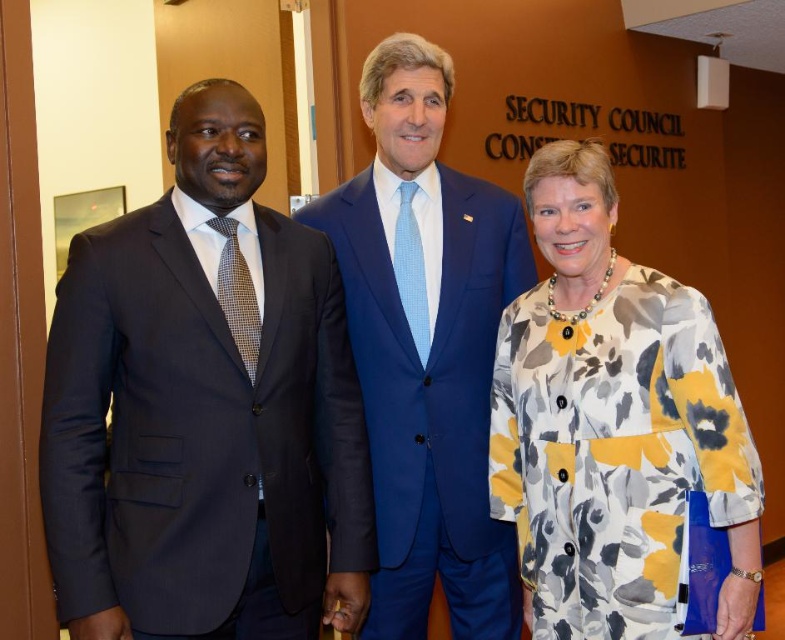
You are standing 10 feet away from the image. There is a point at coordinates point [599,278]. Can you reach this point with a 4.5 foot long stick?

The distance of point [599,278] from viewer is 5.64 feet. Since the stick is only 4.5 feet long, you cannot reach the point with the stick.